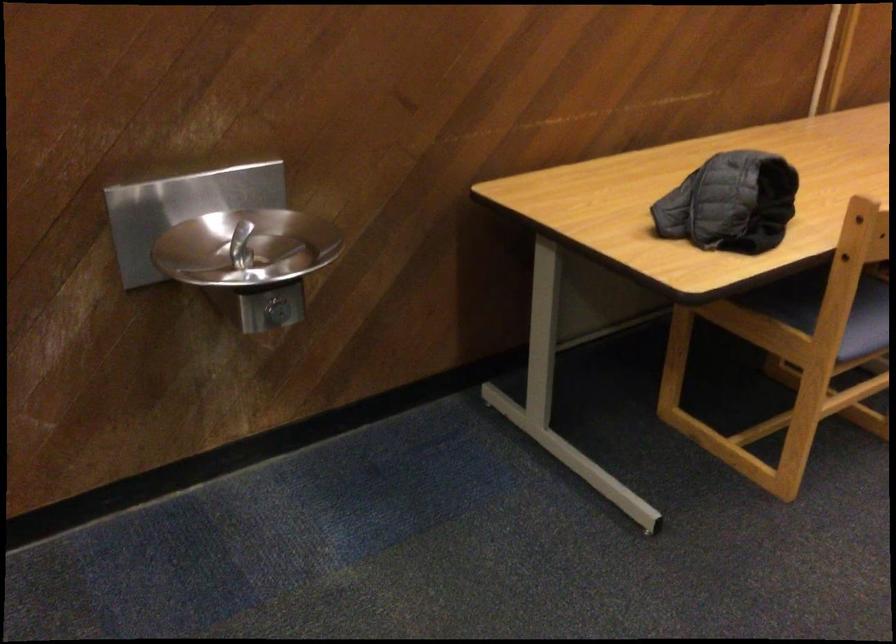
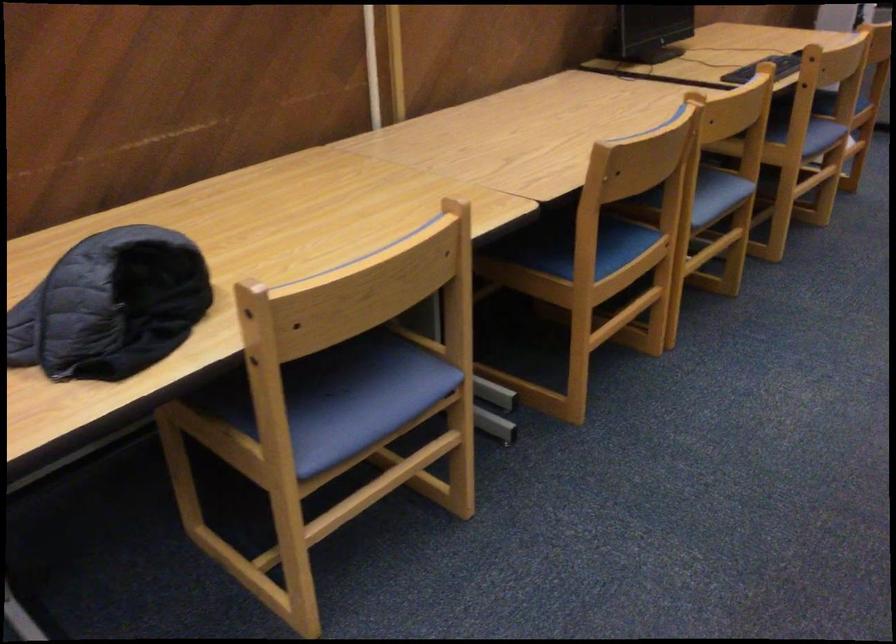
Find the pixel in the second image that matches point (748, 192) in the first image.

(110, 305)